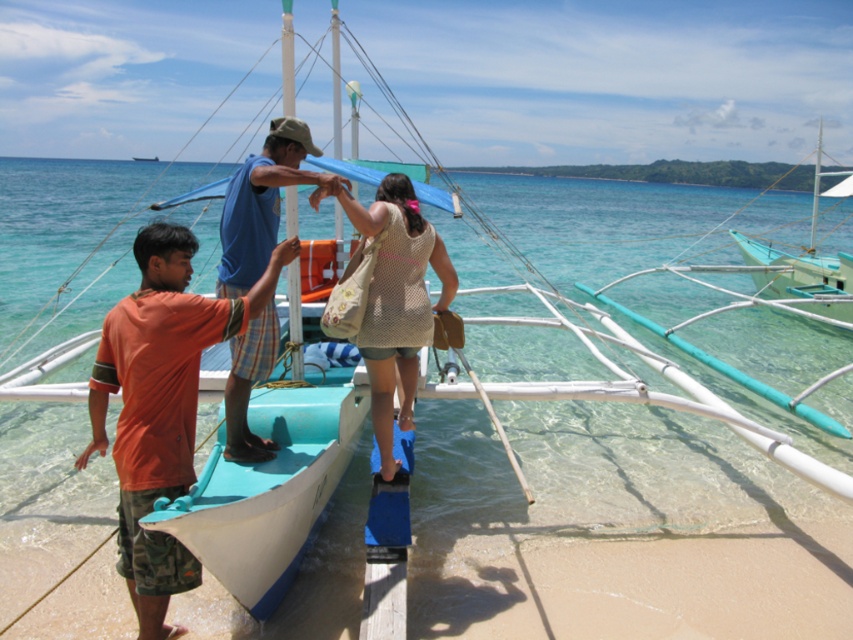
You are a photographer on the beach and want to capture a photo of the blue plaid shorts at center and the teal wooden boat at right. Based on their positions, which object is closer to the left side of the photo frame?

The blue plaid shorts at center is closer to the left side of the photo frame because it is positioned to the left of the teal wooden boat at right.

You are a photographer standing on the beach and want to take a photo of the beige crochet bag at center and the teal wooden boat at right. Which object will appear larger in the photo?

The beige crochet bag at center will appear larger in the photo because it is closer to the viewer than the teal wooden boat at right.